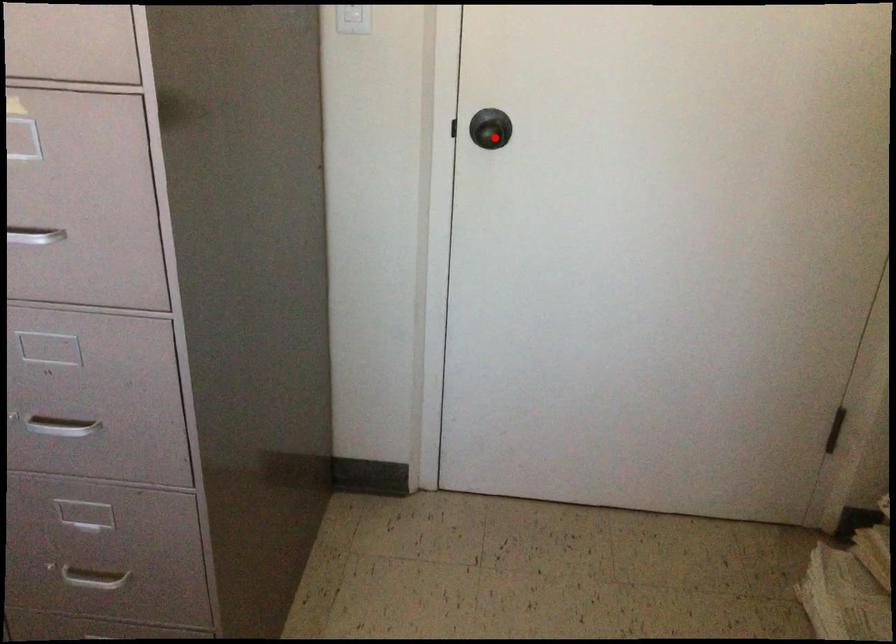
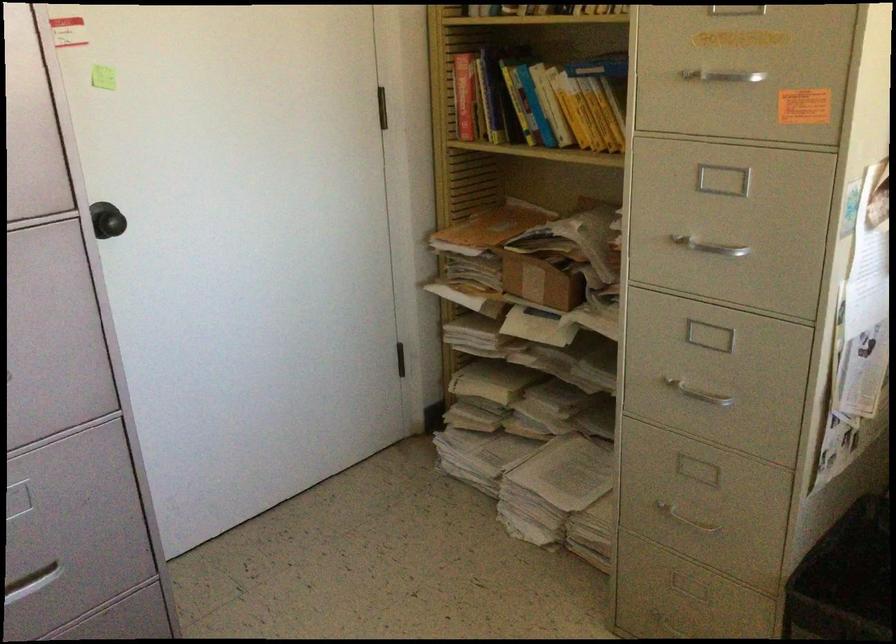
Locate, in the second image, the point that corresponds to the highlighted location in the first image.

(115, 223)